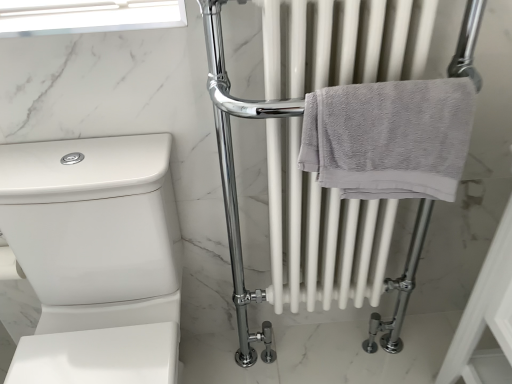
Question: From the image's perspective, is transparent glass window screen at upper left positioned above or below gray cotton towel at center right?

Choices:
 (A) below
 (B) above

Answer: (B)

Question: Does point (0, 9) appear closer or farther from the camera than point (458, 117)?

Choices:
 (A) closer
 (B) farther

Answer: (B)

Question: Based on their relative distances, which object is nearer to the transparent glass window screen at upper left?

Choices:
 (A) white glossy toilet at lower left
 (B) gray cotton towel at center right

Answer: (A)

Question: Considering the real-world distances, which object is closest to the gray cotton towel at center right?

Choices:
 (A) white glossy toilet at lower left
 (B) transparent glass window screen at upper left

Answer: (B)